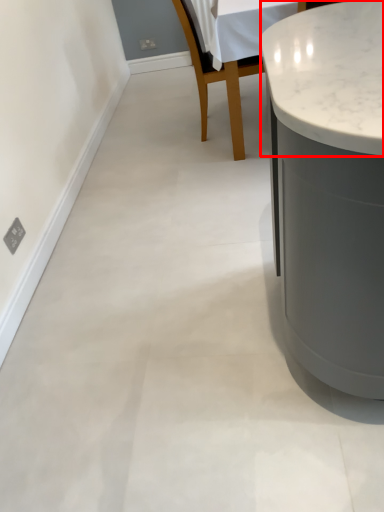
Question: In this image, where is counter top (annotated by the red box) located relative to chair?

Choices:
 (A) left
 (B) right

Answer: (B)